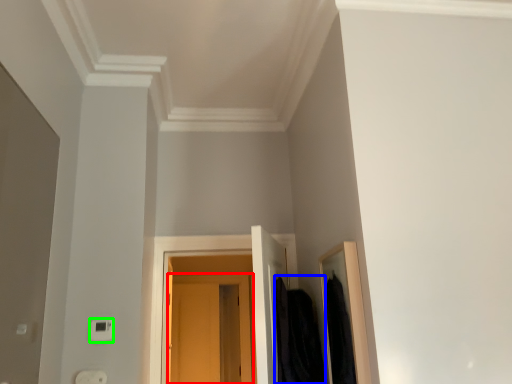
Question: Estimate the real-world distances between objects in this image. Which object is closer to door (highlighted by a red box), clothing (highlighted by a blue box) or light switch (highlighted by a green box)?

Choices:
 (A) clothing
 (B) light switch

Answer: (A)